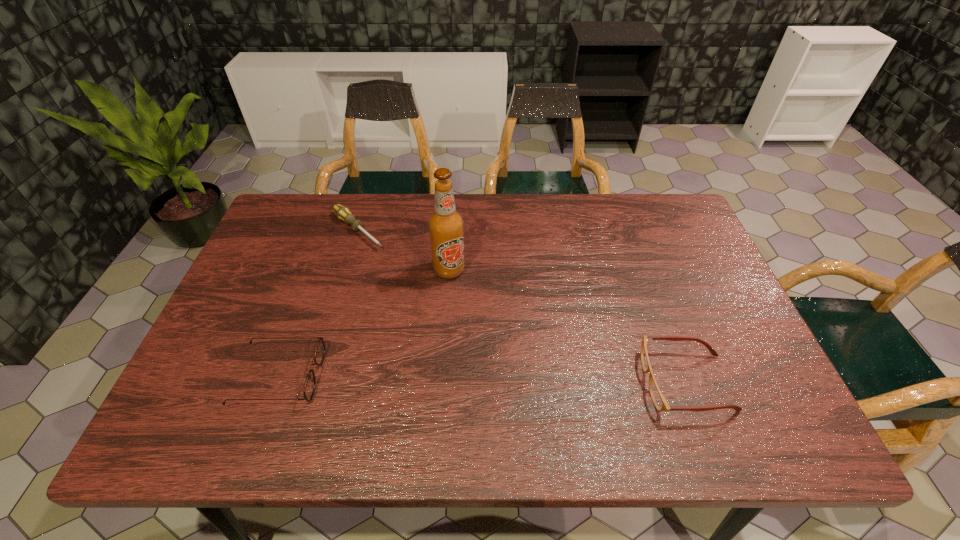
Find the location of a particular element. The width and height of the screenshot is (960, 540). sunglasses is located at coordinates (309, 388).

The height and width of the screenshot is (540, 960). Identify the location of the rightmost object. (658, 398).

You are a GUI agent. You are given a task and a screenshot of the screen. Output one action in this format:
    pyautogui.click(x=<x>, y=<y>)
    Task: Click on the shortest object
    This screenshot has width=960, height=540.
    Given the screenshot: What is the action you would take?
    pyautogui.click(x=343, y=213)

I want to click on the farthest object, so click(343, 213).

Find the location of a particular element. The width and height of the screenshot is (960, 540). the tallest object is located at coordinates (446, 225).

Image resolution: width=960 pixels, height=540 pixels. I want to click on the third nearest object, so click(446, 225).

The image size is (960, 540). In order to click on vacant space located 0.350m on the front-facing side of the sunglasses in this screenshot , I will do `click(473, 376)`.

You are a GUI agent. You are given a task and a screenshot of the screen. Output one action in this format:
    pyautogui.click(x=<x>, y=<y>)
    Task: Click on the free location located 0.180m on the front-facing side of the spectacles
    The height and width of the screenshot is (540, 960).
    Given the screenshot: What is the action you would take?
    563,382

At what (x,y) coordinates should I click in order to perform the action: click on free space located 0.200m on the front-facing side of the spectacles. Please return your answer as a coordinate pair (x, y). Image resolution: width=960 pixels, height=540 pixels. Looking at the image, I should click on (554, 382).

The width and height of the screenshot is (960, 540). I want to click on vacant space located on the front-facing side of the spectacles, so click(589, 382).